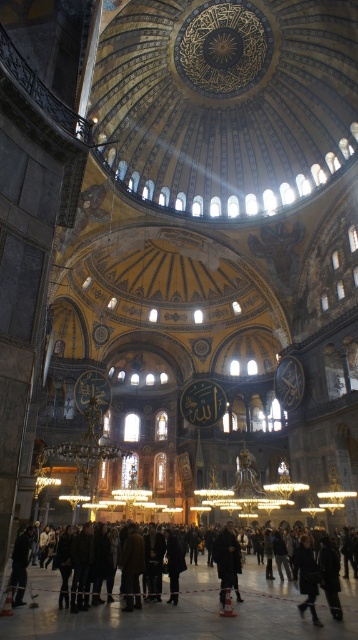
You are standing in the grand cathedral and see the brown leather coat at center and the dark brown leather coat at lower right. Which coat is positioned to the left when viewed from your perspective?

The brown leather coat at center is positioned to the left of the dark brown leather coat at lower right, so the brown leather coat at center is on the left side.

You are standing inside the grand building and looking at the ceiling. There are two points marked on the ceiling, point (235, 596) and point (298, 580). Which point is closer to your eyes?

Point (235, 596) is further to the camera than point (298, 580), so the point closer to your eyes is point (298, 580).

You are standing in the grand cathedral and see two coats. The dark wool coat at center and the dark brown leather coat at lower right. Which coat is positioned to the left when facing the coats from the entrance?

The dark wool coat at center is positioned to the left of the dark brown leather coat at lower right.